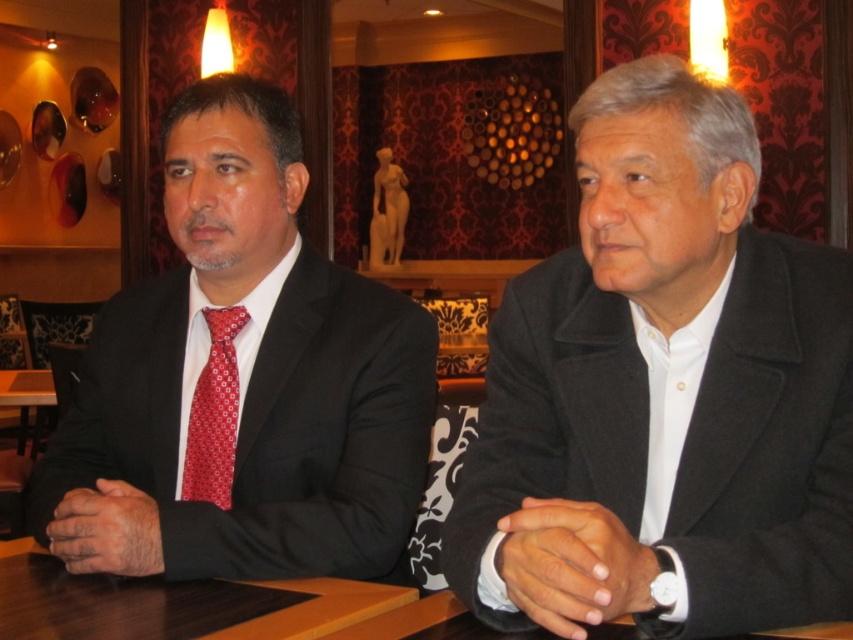
Question: Can you confirm if black wool coat at right is bigger than brown wooden table at center?

Choices:
 (A) no
 (B) yes

Answer: (B)

Question: Which object is positioned farthest from the red silk tie at left?

Choices:
 (A) brown wooden table at center
 (B) black wool coat at right
 (C) matte black suit at left

Answer: (B)

Question: Which of the following is the closest to the observer?

Choices:
 (A) brown wooden table at center
 (B) red silk tie at left
 (C) black wool coat at right

Answer: (C)

Question: Does black wool coat at right have a lesser width compared to matte black suit at left?

Choices:
 (A) yes
 (B) no

Answer: (A)

Question: Can you confirm if matte black suit at left is positioned to the right of brown wooden table at center?

Choices:
 (A) no
 (B) yes

Answer: (B)

Question: Which object is farther from the camera taking this photo?

Choices:
 (A) red silk tie at left
 (B) brown wooden table at center
 (C) black wool coat at right
 (D) matte black suit at left

Answer: (A)